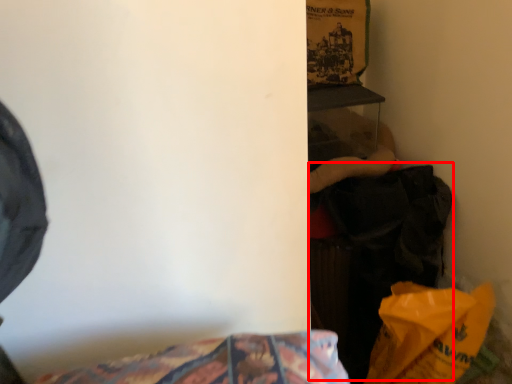
Question: Where is clothing (annotated by the red box) located in relation to paper bag in the image?

Choices:
 (A) left
 (B) right

Answer: (A)